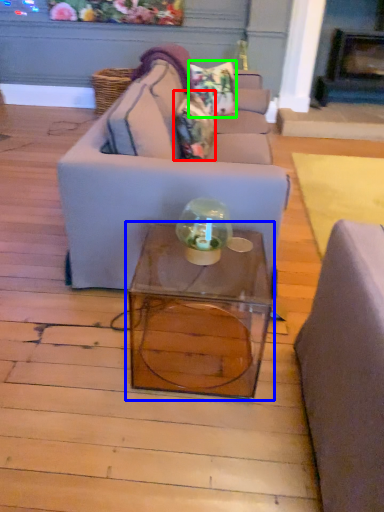
Question: Which object is positioned closest to pillow (highlighted by a red box)? Select from table (highlighted by a blue box) and pillow (highlighted by a green box).

Choices:
 (A) table
 (B) pillow

Answer: (B)